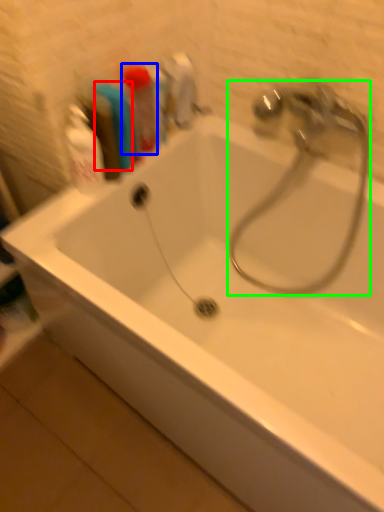
Question: Based on their relative distances, which object is nearer to toiletry (highlighted by a red box)? Choose from toiletry (highlighted by a blue box) and tap (highlighted by a green box).

Choices:
 (A) toiletry
 (B) tap

Answer: (A)